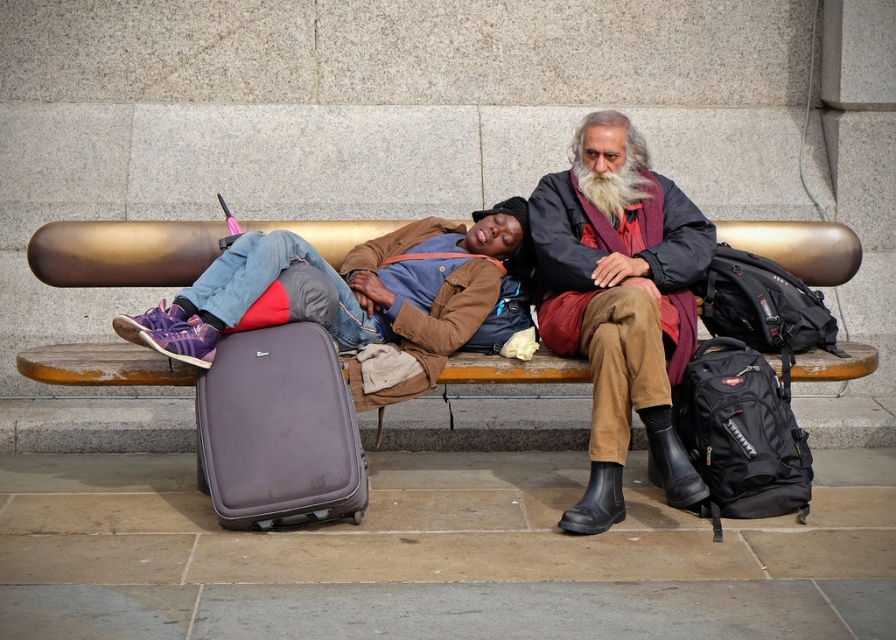
Question: Which point is farther to the camera?

Choices:
 (A) wooden bench at center
 (B) brown suede jacket at center
 (C) purple matte suitcase at lower left

Answer: (A)

Question: Does wooden bench at center have a smaller size compared to brown suede jacket at center?

Choices:
 (A) yes
 (B) no

Answer: (A)

Question: Which point is closer to the camera?

Choices:
 (A) purple matte suitcase at lower left
 (B) brown suede jacket at center
 (C) wooden bench at center

Answer: (A)

Question: Does wooden bench at center appear on the left side of purple matte suitcase at lower left?

Choices:
 (A) no
 (B) yes

Answer: (A)

Question: Is wooden bench at center smaller than purple matte suitcase at lower left?

Choices:
 (A) no
 (B) yes

Answer: (B)

Question: Which object is closer to the camera taking this photo?

Choices:
 (A) brown suede jacket at center
 (B) purple matte suitcase at lower left
 (C) wooden bench at center

Answer: (B)